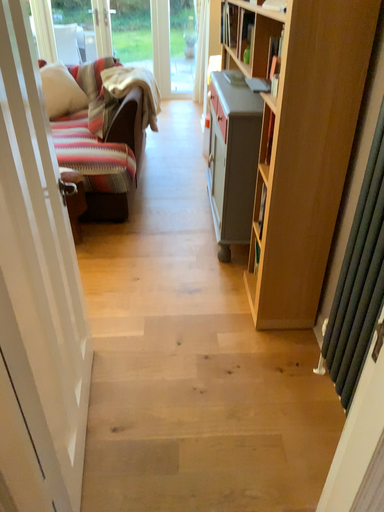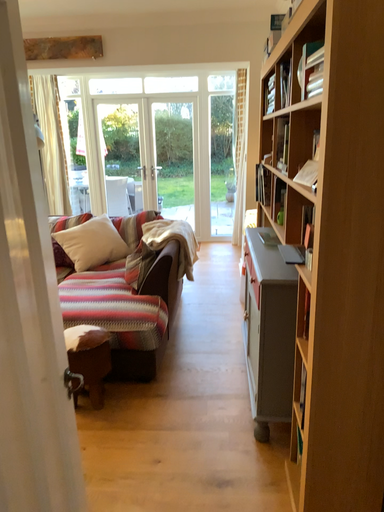
Question: Which way did the camera rotate in the video?

Choices:
 (A) rotated downward
 (B) rotated upward

Answer: (B)